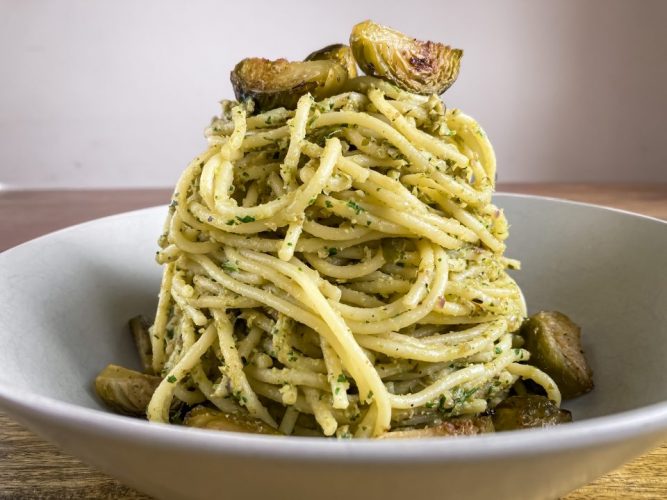
This screenshot has width=667, height=500. I want to click on the bottom edge of bowl, so click(x=7, y=394), click(x=61, y=408), click(x=201, y=433), click(x=375, y=445), click(x=537, y=439), click(x=629, y=420).